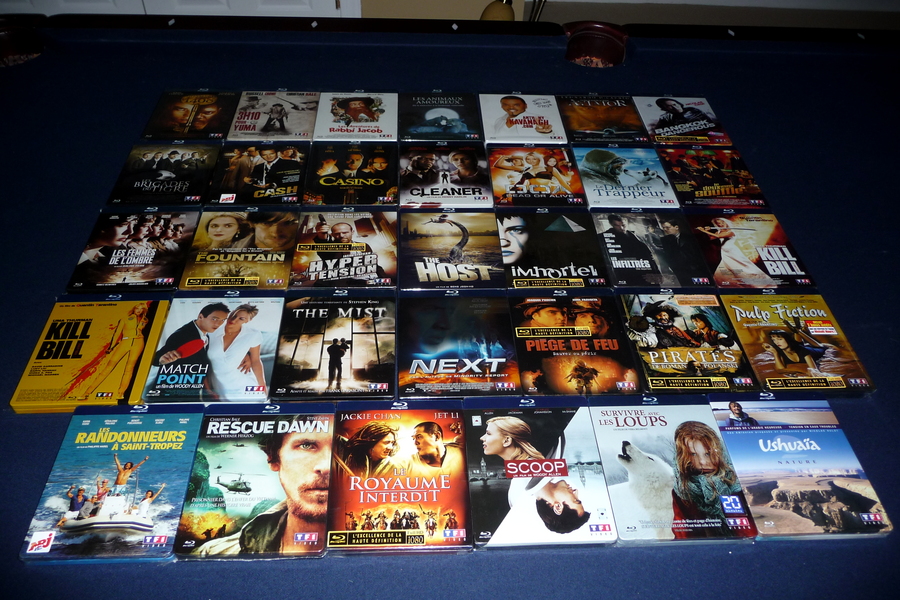
Locate an element on the screen. The image size is (900, 600). movie cases in bottom row is located at coordinates (110, 457), (249, 481), (393, 474), (591, 499), (691, 496), (778, 490).